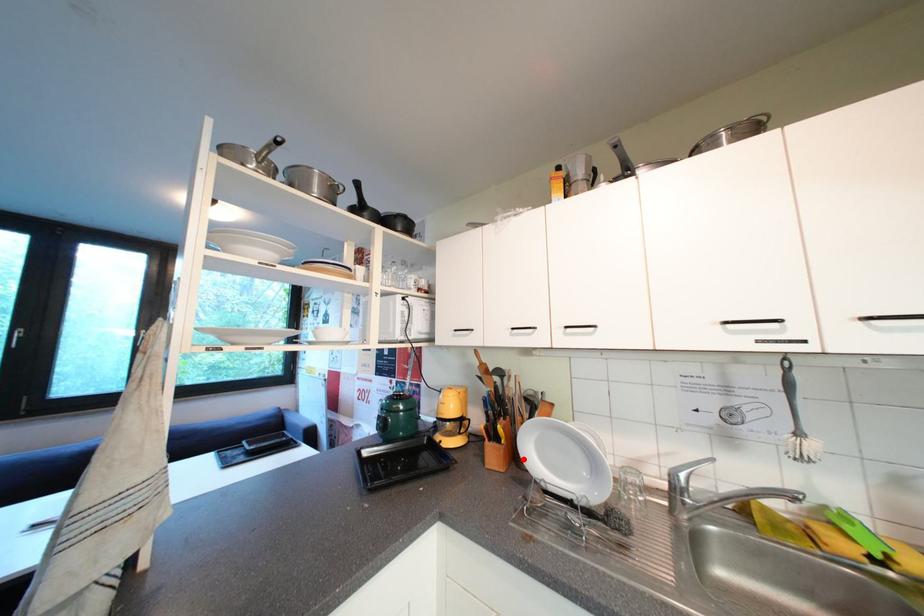
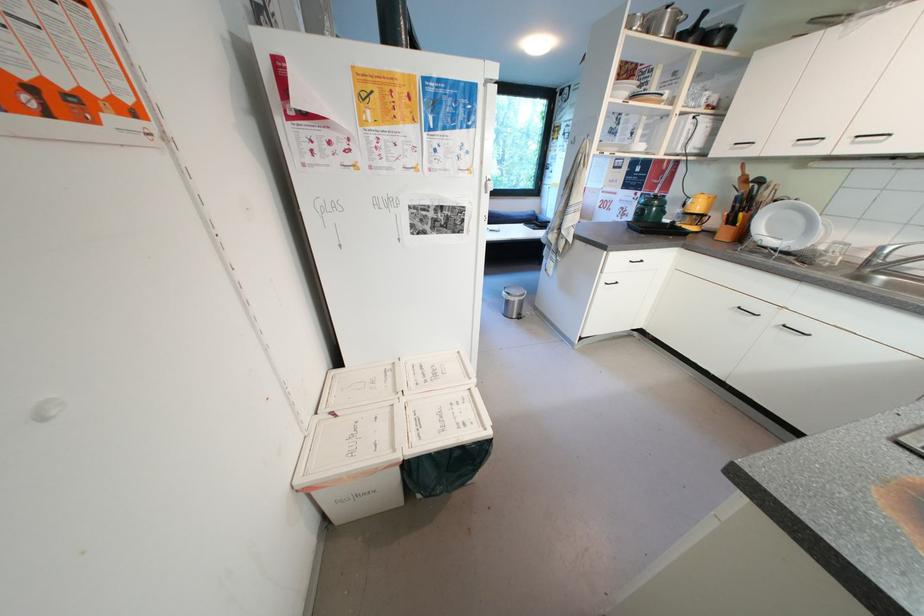
Question: I am providing you with two images of the same scene from different viewpoints. Image1 has a red point marked. In image2, the corresponding 3D location appears at what relative position? Reply with the corresponding letter.

Choices:
 (A) Closer
 (B) Farther

Answer: (A)